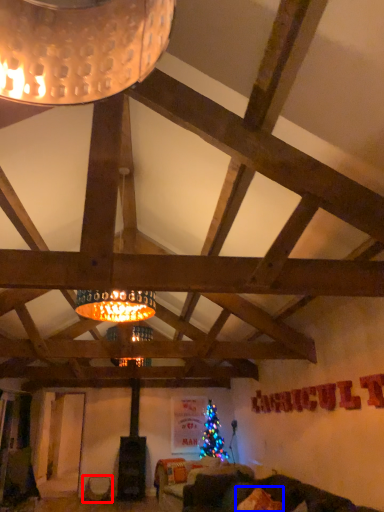
Question: Which point is closer to the camera, furniture (highlighted by a red box) or pillow (highlighted by a blue box)?

Choices:
 (A) furniture
 (B) pillow

Answer: (B)